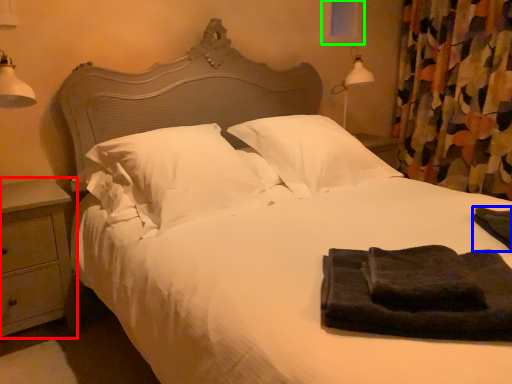
Question: Which object is positioned closest to nightstand (highlighted by a red box)? Select from material (highlighted by a blue box) and window screen (highlighted by a green box).

Choices:
 (A) material
 (B) window screen

Answer: (A)